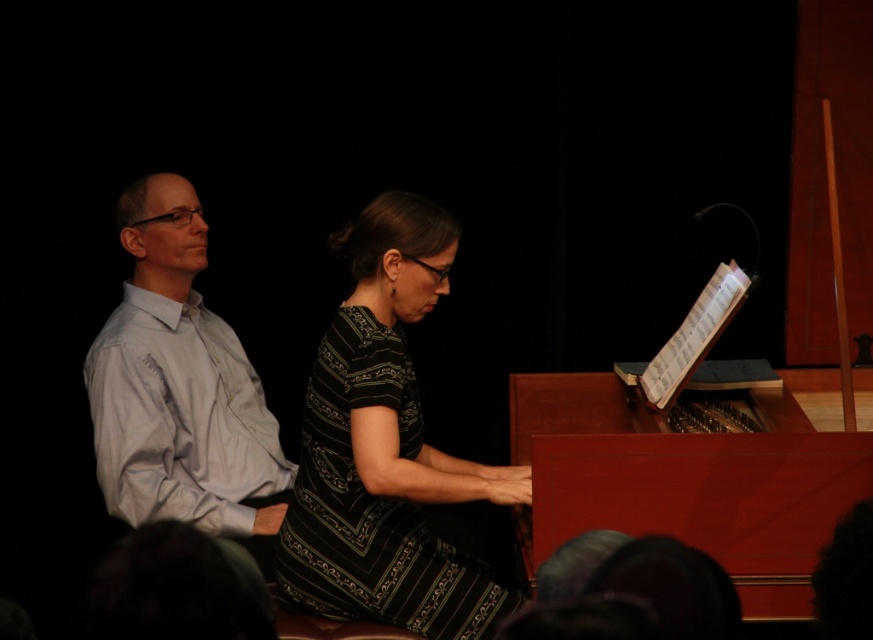
Consider the image. You are standing in the room where the musical performance is taking place. There is a point marked at coordinates point (774,611). Can you reach this point without moving past the piano?

The point (774,611) is 7.11 feet away from you, so yes, you can reach it without moving past the piano since it is within a reasonable distance.

You are a photographer positioned near the camera in the scene. You want to capture a closeup of the striped fabric dress at center. Given that the camera has a minimum focusing distance of 5 feet, will you be able to take the photo without moving closer?

The striped fabric dress at center and camera are 6.91 feet apart. Since the minimum focusing distance is 5 feet, the photographer can take the closeup without moving closer because the distance is within the camera capabilities.

You are a photographer positioned behind the piano, and you want to take a photo of both the striped fabric dress at center and the white smooth shirt at left in the same frame. Given that your camera has a maximum focus range of 25 inches, will both subjects be in focus?

The striped fabric dress at center is 24.53 inches away from the white smooth shirt at left. Since the distance between them is within the camera maximum focus range of 25 inches, both subjects will be in focus.